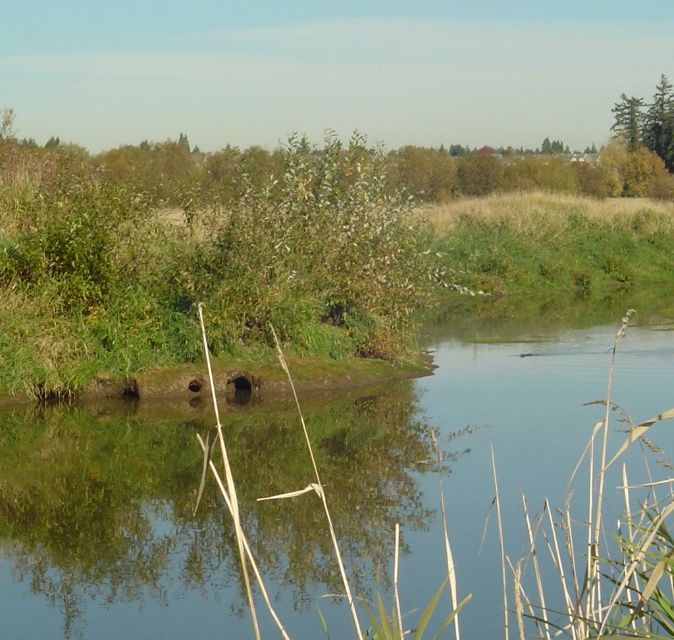
You are standing on the bank of the green grassy river at center and want to reach the green leafy tree at upper right. Which direction should you walk to get closer to the tree?

The green grassy river at center is in front of the green leafy tree at upper right, so you should walk towards the tree behind the river to get closer.

You are standing at the edge of the pond and see two points marked in the image. The first point is at coordinate point [580,480] and the second is at point [630,113]. Which point is closer to you?

Point [580,480] is in front of point [630,113], so the first point is closer to you.

You are standing on the bank of the green grassy river at center and want to reach the green leafy tree at upper right. Which direction should you walk to get closer to the tree?

The green leafy tree at upper right is taller than the green grassy river at center, so you should walk towards the upper right direction to get closer to the tree.